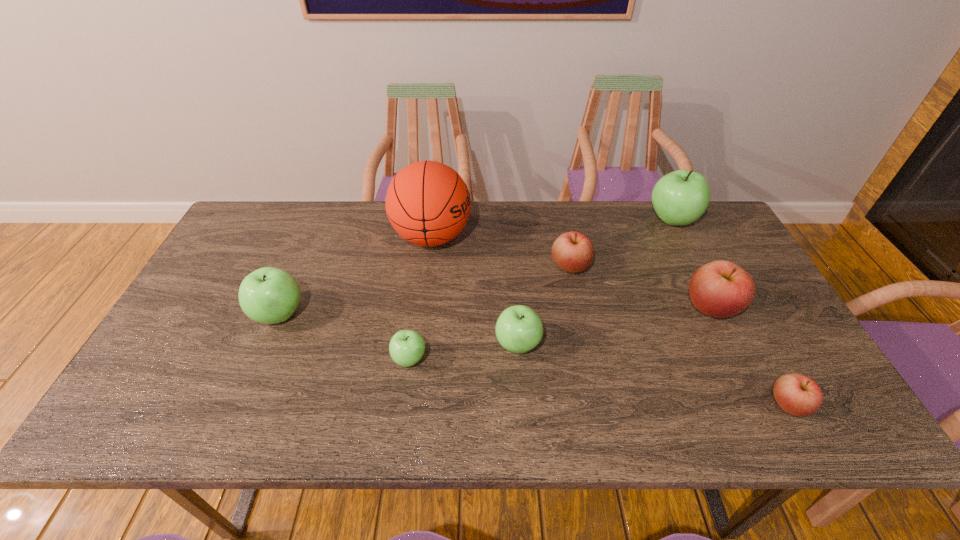
The width and height of the screenshot is (960, 540). I want to click on the smallest green apple, so click(406, 348).

In order to click on the second green apple from left to right in this screenshot , I will do [406, 348].

Where is `the nearest red apple`? The width and height of the screenshot is (960, 540). the nearest red apple is located at coordinates click(799, 395).

Identify the location of the smallest red apple. (799, 395).

At what (x,y) coordinates should I click in order to perform the action: click on vacant position located 0.400m on the side with logo of the tallest object. Please return your answer as a coordinate pair (x, y). This screenshot has height=540, width=960. Looking at the image, I should click on (598, 237).

Where is `vacant space situated 0.150m on the front of the tallest apple`? The image size is (960, 540). vacant space situated 0.150m on the front of the tallest apple is located at coordinates (697, 269).

Identify the location of free region located 0.080m on the left of the leftmost object. Image resolution: width=960 pixels, height=540 pixels. (223, 314).

Identify the location of vacant space situated on the left of the second farthest red apple. The image size is (960, 540). [642, 307].

Where is `free location located 0.350m on the left of the third apple from left to right`? The image size is (960, 540). free location located 0.350m on the left of the third apple from left to right is located at coordinates (354, 345).

At what (x,y) coordinates should I click in order to perform the action: click on vacant area situated 0.350m on the right of the second farthest apple. Please return your answer as a coordinate pair (x, y). Image resolution: width=960 pixels, height=540 pixels. Looking at the image, I should click on (709, 266).